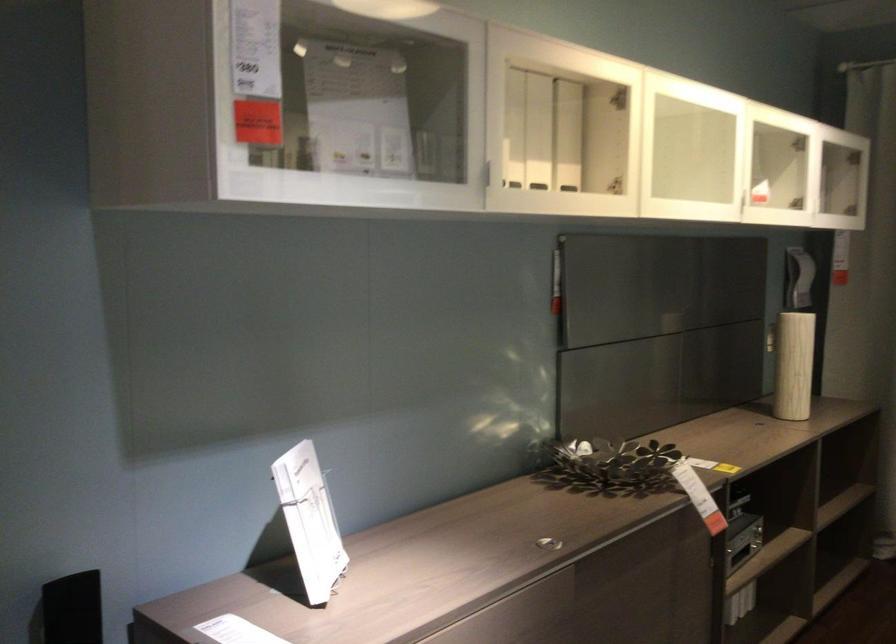
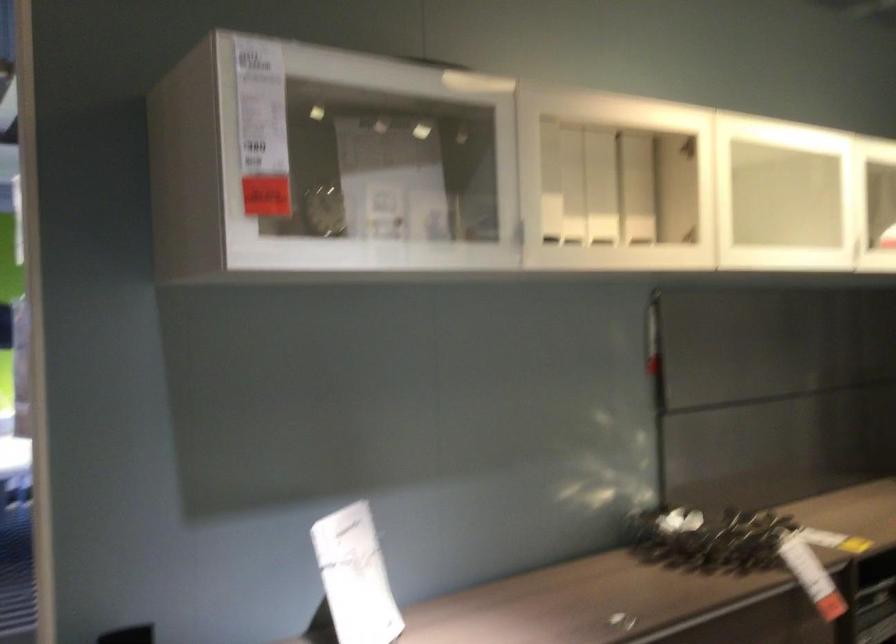
Question: I am providing you with two images of the same scene from different viewpoints. Please identify which objects are invisible in image2.

Choices:
 (A) dark metal handle
 (B) silver cabinet handle
 (C) white paper stand
 (D) none of these

Answer: (D)